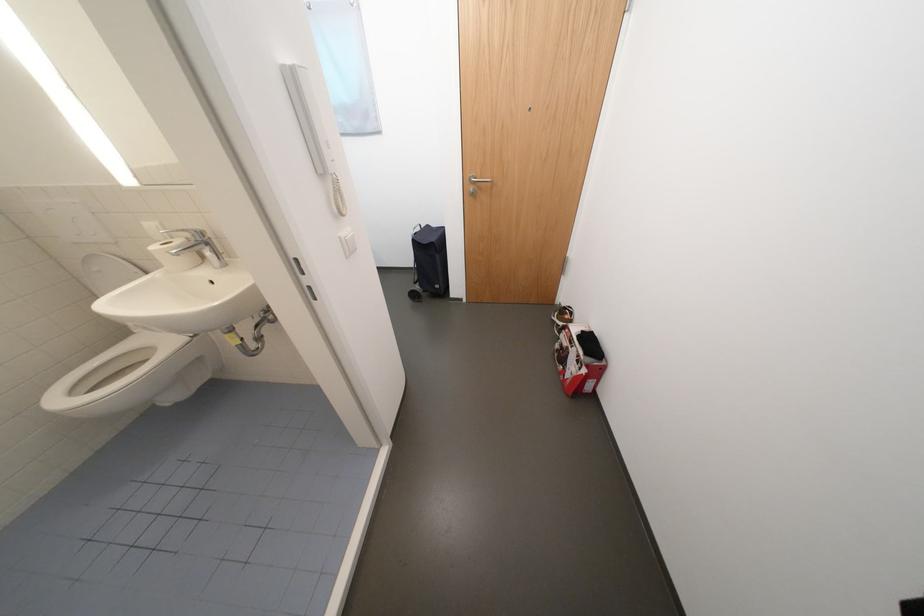
This screenshot has width=924, height=616. Describe the element at coordinates (188, 220) in the screenshot. I see `a faucet lever handle` at that location.